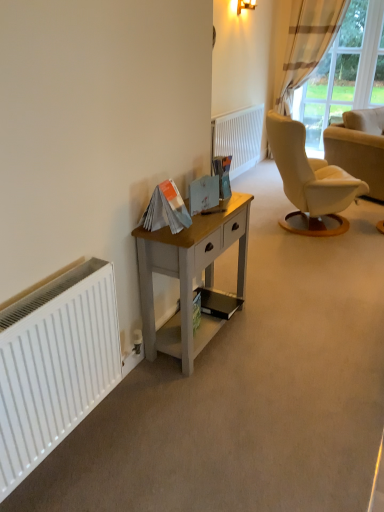
This screenshot has height=512, width=384. Describe the element at coordinates (359, 147) in the screenshot. I see `white fabric chair at right` at that location.

Measure the distance between point (92, 277) and camera.

They are 1.56 meters apart.

Find the location of a particular element. light gray wood desk at center is located at coordinates (189, 275).

This screenshot has width=384, height=512. I want to click on brown striped fabric curtain at upper right, so click(307, 42).

The height and width of the screenshot is (512, 384). I want to click on plaid fabric curtain at upper right, so click(x=345, y=72).

The height and width of the screenshot is (512, 384). Describe the element at coordinates (345, 72) in the screenshot. I see `plaid fabric curtain at upper right` at that location.

I want to click on white fabric chair at right, so click(x=359, y=147).

Can you tell me how much white textured radiator at center, the first radiator from the right, and light gray wood desk at center differ in facing direction?

The angle between the facing direction of white textured radiator at center, the first radiator from the right, and the facing direction of light gray wood desk at center is 0.845 degrees.

Based on the photo, from the image's perspective, which is below, white textured radiator at center, the second radiator in the bottom-to-top sequence, or light gray wood desk at center?

From the image's view, light gray wood desk at center is below.

Where is `radiator that is the 1st one above the light gray wood desk at center (from a real-world perspective)`? radiator that is the 1st one above the light gray wood desk at center (from a real-world perspective) is located at coordinates (239, 138).

Can you confirm if white textured radiator at center, positioned as the 2th radiator in front-to-back order, is wider than light gray wood desk at center?

Incorrect, the width of white textured radiator at center, positioned as the 2th radiator in front-to-back order, does not surpass that of light gray wood desk at center.

Is light gray wood desk at center thinner than plaid fabric curtain at upper right?

Incorrect, the width of light gray wood desk at center is not less than that of plaid fabric curtain at upper right.

From a real-world perspective, which object rests below the other?

light gray wood desk at center is physically lower.

Is light gray wood desk at center oriented towards plaid fabric curtain at upper right?

No, light gray wood desk at center is not aimed at plaid fabric curtain at upper right.

Is plaid fabric curtain at upper right completely or partially inside light gray wood desk at center?

Actually, plaid fabric curtain at upper right is outside light gray wood desk at center.

Is white fabric chair at right surrounding white textured radiator at center, the 2th radiator when ordered from left to right?

No, white textured radiator at center, the 2th radiator when ordered from left to right, is not surrounded by white fabric chair at right.

In the scene shown: Between white fabric chair at right and white textured radiator at center, positioned as the 2th radiator in front-to-back order, which one appears on the left side from the viewer's perspective?

white textured radiator at center, positioned as the 2th radiator in front-to-back order, is more to the left.

Does white fabric chair at right touch white textured radiator at center, which appears as the 1th radiator when viewed from the back?

white fabric chair at right and white textured radiator at center, which appears as the 1th radiator when viewed from the back, are not in contact.

Can you confirm if white fabric chair at right is thinner than white textured radiator at center, the first radiator from the right?

No, white fabric chair at right is not thinner than white textured radiator at center, the first radiator from the right.

From the image's perspective, which is above, white textured radiator at center, positioned as the 2th radiator in front-to-back order, or white fabric chair at right?

From the image's view, white textured radiator at center, positioned as the 2th radiator in front-to-back order, is above.

Which point is more forward, [231,144] or [378,163]?

Positioned in front is point [378,163].

Is white textured radiator at center, positioned as the 2th radiator in front-to-back order, facing away from white fabric chair at right?

No, white textured radiator at center, positioned as the 2th radiator in front-to-back order,'s orientation is not away from white fabric chair at right.

Based on the photo, can you confirm if white textured radiator at center, the second radiator in the bottom-to-top sequence, is taller than white fabric chair at right?

Yes, white textured radiator at center, the second radiator in the bottom-to-top sequence, is taller than white fabric chair at right.

From a real-world perspective, which object stands above the other?

In real-world perspective, matte gold wall sconce at upper center is above.

Considering the relative sizes of plaid fabric curtain at upper right and matte gold wall sconce at upper center in the image provided, is plaid fabric curtain at upper right taller than matte gold wall sconce at upper center?

Indeed, plaid fabric curtain at upper right has a greater height compared to matte gold wall sconce at upper center.

Could you tell me if plaid fabric curtain at upper right is facing matte gold wall sconce at upper center?

Yes.

Does plaid fabric curtain at upper right have a lesser width compared to matte gold wall sconce at upper center?

Yes.

How many degrees apart are the facing directions of plaid fabric curtain at upper right and brown striped fabric curtain at upper right?

0.565 degrees separate the facing orientations of plaid fabric curtain at upper right and brown striped fabric curtain at upper right.

From a real-world perspective, is plaid fabric curtain at upper right physically located above or below brown striped fabric curtain at upper right?

From a real-world perspective, plaid fabric curtain at upper right is physically above brown striped fabric curtain at upper right.

From the image's perspective, is plaid fabric curtain at upper right positioned above or below brown striped fabric curtain at upper right?

plaid fabric curtain at upper right is above brown striped fabric curtain at upper right.

Would you say plaid fabric curtain at upper right is outside brown striped fabric curtain at upper right?

Yes, plaid fabric curtain at upper right is outside of brown striped fabric curtain at upper right.

Between plaid fabric curtain at upper right and light gray wood desk at center, which one has smaller size?

light gray wood desk at center.

Looking at their sizes, would you say plaid fabric curtain at upper right is wider or thinner than light gray wood desk at center?

plaid fabric curtain at upper right is thinner than light gray wood desk at center.

Is plaid fabric curtain at upper right positioned with its back to light gray wood desk at center?

No.

What's the angular difference between plaid fabric curtain at upper right and light gray wood desk at center's facing directions?

The angle between the facing direction of plaid fabric curtain at upper right and the facing direction of light gray wood desk at center is 90.3 degrees.

At what (x,y) coordinates should I click in order to perform the action: click on desk below the white textured radiator at center, positioned as the 2th radiator in front-to-back order (from the image's perspective). Please return your answer as a coordinate pair (x, y). The height and width of the screenshot is (512, 384). Looking at the image, I should click on (189, 275).

Locate an element on the screen. The height and width of the screenshot is (512, 384). bay window behind the light gray wood desk at center is located at coordinates (345, 72).

From the image, which object appears to be nearer to matte gold wall sconce at upper center, white fabric chair at right or white matte radiator at left, the first radiator from the bottom?

The object closer to matte gold wall sconce at upper center is white fabric chair at right.

When comparing their distances from matte gold wall sconce at upper center, does white fabric chair at right or plaid fabric curtain at upper right seem further?

The object further to matte gold wall sconce at upper center is white fabric chair at right.

Considering their positions, is plaid fabric curtain at upper right positioned further to white fabric chair at right than brown striped fabric curtain at upper right?

The object further to white fabric chair at right is brown striped fabric curtain at upper right.

Looking at the image, which one is located closer to white fabric chair at right, plaid fabric curtain at upper right or matte gold wall sconce at upper center?

Among the two, plaid fabric curtain at upper right is located nearer to white fabric chair at right.

When comparing their distances from white textured radiator at center, positioned as the 2th radiator in front-to-back order, does plaid fabric curtain at upper right or light gray wood desk at center seem further?

Among the two, light gray wood desk at center is located further to white textured radiator at center, positioned as the 2th radiator in front-to-back order.

Estimate the real-world distances between objects in this image. Which object is further from white fabric chair at right, matte gold wall sconce at upper center or brown striped fabric curtain at upper right?

Based on the image, brown striped fabric curtain at upper right appears to be further to white fabric chair at right.

Consider the image. Based on their spatial positions, is white matte radiator at left, acting as the 2th radiator starting from the right, or matte gold wall sconce at upper center closer to brown striped fabric curtain at upper right?

matte gold wall sconce at upper center.

From the image, which object appears to be farther from plaid fabric curtain at upper right, white matte radiator at left, which is the first radiator from front to back, or light gray wood desk at center?

The object further to plaid fabric curtain at upper right is white matte radiator at left, which is the first radiator from front to back.

Locate an element on the screen. lamp between white matte radiator at left, the first radiator from the bottom, and plaid fabric curtain at upper right from front to back is located at coordinates (245, 5).

At what (x,y) coordinates should I click in order to perform the action: click on lamp between white textured radiator at center, positioned as the 2th radiator in front-to-back order, and plaid fabric curtain at upper right. Please return your answer as a coordinate pair (x, y). This screenshot has height=512, width=384. Looking at the image, I should click on (245, 5).

This screenshot has width=384, height=512. What are the coordinates of `desk positioned between white matte radiator at left, the first radiator when ordered from left to right, and white textured radiator at center, the 1th radiator positioned from the top, from near to far` in the screenshot? It's located at (189, 275).

Identify the location of curtain positioned between white matte radiator at left, the first radiator when ordered from left to right, and plaid fabric curtain at upper right from near to far. The height and width of the screenshot is (512, 384). (307, 42).